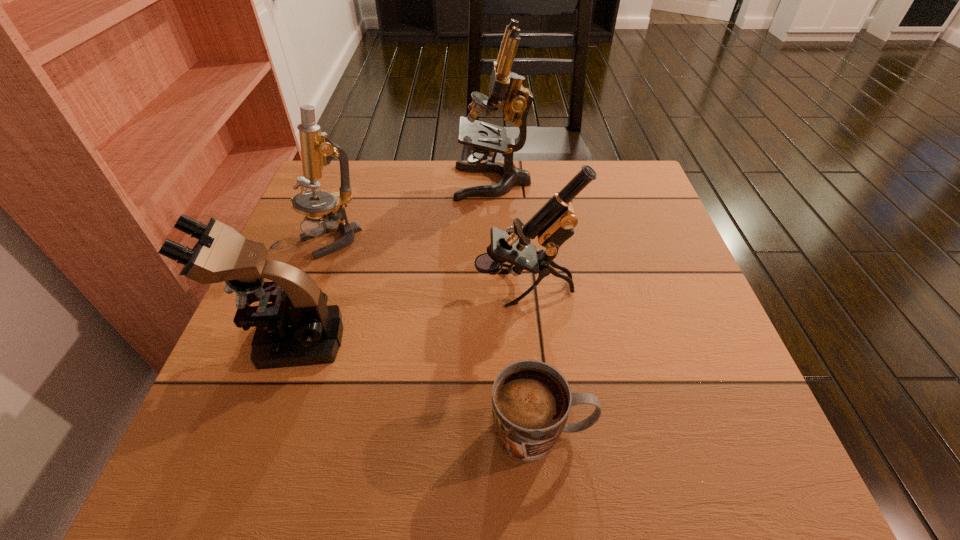
Image resolution: width=960 pixels, height=540 pixels. Identify the location of blank space located on the back of the second farthest microscope. (356, 168).

Find the location of a particular element. vacant space located through the eyepiece of the third farthest microscope is located at coordinates (423, 288).

Identify the location of free space located through the eyepiece of the third farthest microscope. (423, 288).

The height and width of the screenshot is (540, 960). I want to click on free region located 0.260m through the eyepiece of the third farthest microscope, so click(354, 288).

Locate an element on the screen. The width and height of the screenshot is (960, 540). blank area located 0.140m on the back of the nearest microscope is located at coordinates (317, 266).

This screenshot has width=960, height=540. What are the coordinates of `vacant space located on the side of the mug with the handle` in the screenshot? It's located at (622, 433).

Locate an element on the screen. The width and height of the screenshot is (960, 540). object situated at the far edge is located at coordinates (506, 91).

Where is `object present at the near edge`? object present at the near edge is located at coordinates (531, 400).

This screenshot has width=960, height=540. I want to click on vacant area at the far edge of the desktop, so click(x=533, y=170).

The height and width of the screenshot is (540, 960). What are the coordinates of `vacant region at the near edge of the desktop` in the screenshot? It's located at (424, 470).